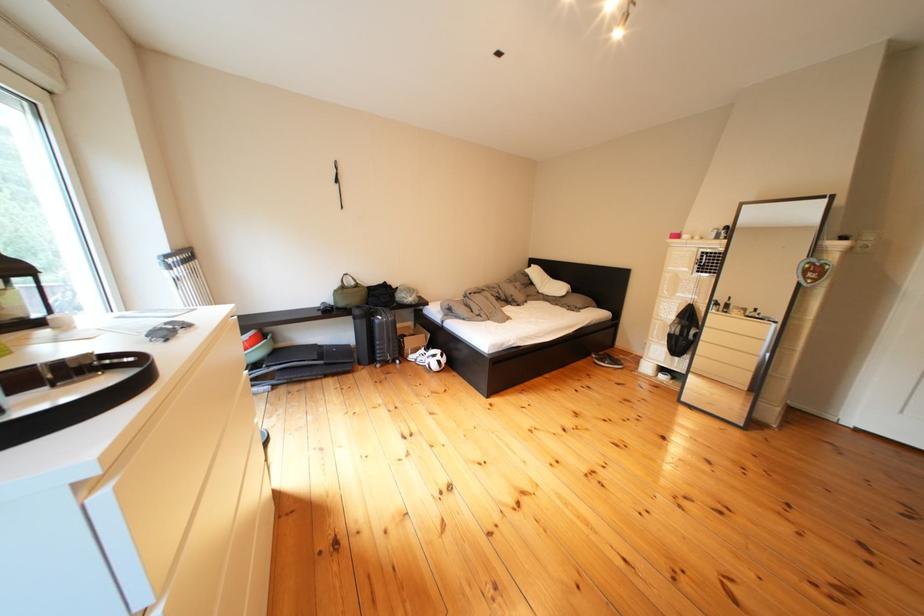
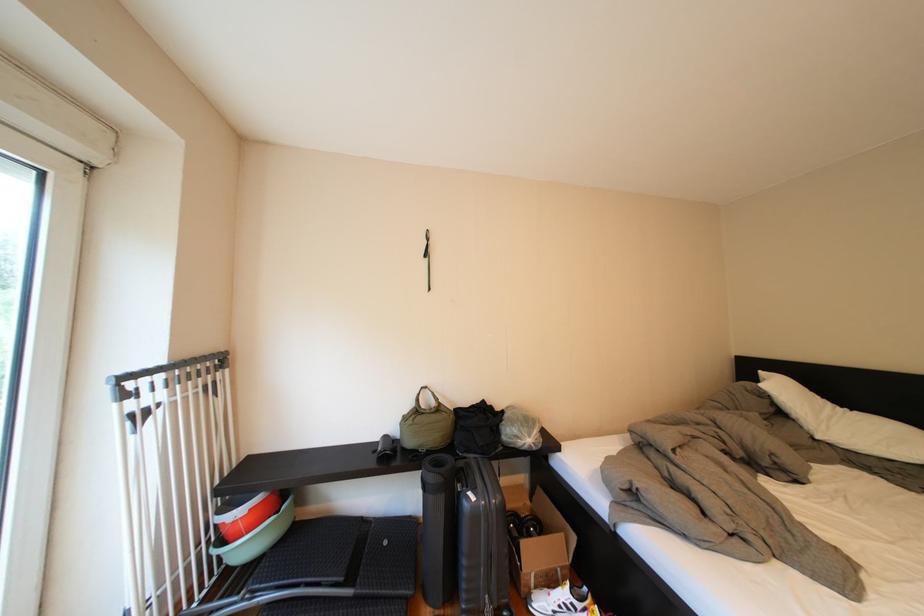
The point at [423,347] is marked in the first image. Where is the corresponding point in the second image?

(544, 557)